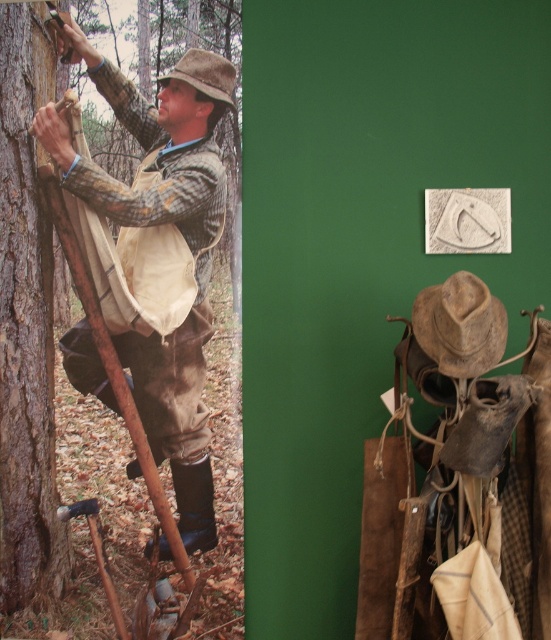
The image size is (551, 640). Describe the element at coordinates (160, 250) in the screenshot. I see `camouflage fabric shirt at left` at that location.

Which is more to the right, camouflage fabric shirt at left or smooth brown bark at left?

camouflage fabric shirt at left is more to the right.

Is point (185, 132) farther from camera compared to point (2, 96)?

Yes, it is.

Image resolution: width=551 pixels, height=640 pixels. In order to click on camouflage fabric shirt at left in this screenshot , I will do `click(160, 250)`.

Which is in front, point (25, 406) or point (204, 186)?

Point (204, 186) is in front.

Based on the photo, who is lower down, smooth brown bark at left or camouflage fabric tree at left?

Positioned lower is smooth brown bark at left.

What are the coordinates of `smooth brown bark at left` in the screenshot? It's located at (25, 324).

Identify the location of smooth brown bark at left. The image size is (551, 640). (25, 324).

How much distance is there between camouflage fabric shirt at left and camouflage fabric tree at left?

A distance of 2.76 inches exists between camouflage fabric shirt at left and camouflage fabric tree at left.

How much distance is there between camouflage fabric shirt at left and camouflage fabric tree at left?

camouflage fabric shirt at left is 2.76 inches away from camouflage fabric tree at left.

This screenshot has height=640, width=551. What do you see at coordinates (160, 250) in the screenshot? I see `camouflage fabric shirt at left` at bounding box center [160, 250].

Find the location of a particular element. This screenshot has width=551, height=640. camouflage fabric shirt at left is located at coordinates (160, 250).